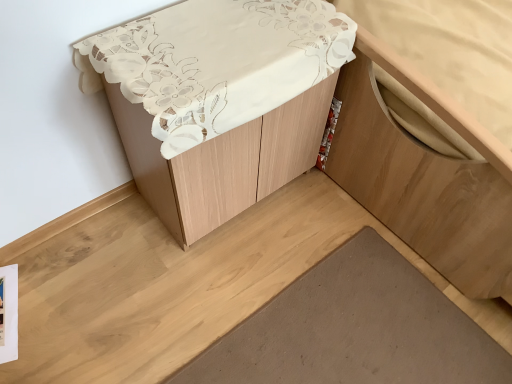
What do you see at coordinates (218, 100) in the screenshot?
I see `matte white cabinet at center` at bounding box center [218, 100].

Image resolution: width=512 pixels, height=384 pixels. Find the location of `matte white cabinet at center`. matte white cabinet at center is located at coordinates pos(218,100).

Locate an element on the screen. Image resolution: width=512 pixels, height=384 pixels. wooden cabinet at lower right is located at coordinates (424, 183).

Is wooden cabinet at lower right bigger or smaller than brown matte wood plank at lower center?

Clearly, wooden cabinet at lower right is larger in size than brown matte wood plank at lower center.

Are wooden cabinet at lower right and brown matte wood plank at lower center far apart?

No, wooden cabinet at lower right is not far from brown matte wood plank at lower center.

From a real-world perspective, is wooden cabinet at lower right physically below brown matte wood plank at lower center?

No, from a real-world perspective, wooden cabinet at lower right is not beneath brown matte wood plank at lower center.

Considering the relative positions of wooden cabinet at lower right and matte white cabinet at center in the image provided, is wooden cabinet at lower right to the right of matte white cabinet at center from the viewer's perspective?

Yes.

Which point is more distant from viewer, (372, 90) or (153, 131)?

The point (372, 90) is farther.

From the image's perspective, which one is positioned lower, wooden cabinet at lower right or matte white cabinet at center?

matte white cabinet at center appears lower in the image.

Is matte white cabinet at center to the left of brown matte wood plank at lower center from the viewer's perspective?

Correct, you'll find matte white cabinet at center to the left of brown matte wood plank at lower center.

From the image's perspective, would you say matte white cabinet at center is positioned over brown matte wood plank at lower center?

A: Yes, from the image's perspective, matte white cabinet at center is over brown matte wood plank at lower center.

Can you confirm if matte white cabinet at center is bigger than brown matte wood plank at lower center?

Indeed, matte white cabinet at center has a larger size compared to brown matte wood plank at lower center.

Is matte white cabinet at center wider or thinner than brown matte wood plank at lower center?

matte white cabinet at center is thinner than brown matte wood plank at lower center.

Which of these two, brown matte wood plank at lower center or matte white cabinet at center, is smaller?

brown matte wood plank at lower center is smaller.

Would you say brown matte wood plank at lower center is to the left or to the right of matte white cabinet at center in the picture?

brown matte wood plank at lower center is positioned on matte white cabinet at center's right side.

Who is taller, brown matte wood plank at lower center or matte white cabinet at center?

matte white cabinet at center.

Which of these two, brown matte wood plank at lower center or matte white cabinet at center, is thinner?

matte white cabinet at center is thinner.

From the image's perspective, which object appears higher, matte white cabinet at center or wooden cabinet at lower right?

wooden cabinet at lower right, from the image's perspective.

Which is closer, (173,204) or (460,215)?

The point (460,215) is closer.

Looking at this image, does matte white cabinet at center have a lesser width compared to wooden cabinet at lower right?

Yes.

At what (x,y) coordinates should I click in order to perform the action: click on cabinetry above the brown matte wood plank at lower center (from a real-world perspective). Please return your answer as a coordinate pair (x, y). This screenshot has height=384, width=512. Looking at the image, I should click on (424, 183).

Can you tell me how much brown matte wood plank at lower center and wooden cabinet at lower right differ in facing direction?

There is a 0.141-degree angle between the facing directions of brown matte wood plank at lower center and wooden cabinet at lower right.

Does brown matte wood plank at lower center turn towards wooden cabinet at lower right?

No, brown matte wood plank at lower center is not oriented towards wooden cabinet at lower right.

Considering the sizes of brown matte wood plank at lower center and wooden cabinet at lower right in the image, is brown matte wood plank at lower center bigger or smaller than wooden cabinet at lower right?

Considering their sizes, brown matte wood plank at lower center takes up less space than wooden cabinet at lower right.

Where is `cabinetry lying on the right of brown matte wood plank at lower center`? The image size is (512, 384). cabinetry lying on the right of brown matte wood plank at lower center is located at coordinates (424, 183).

In the image, there is a wooden cabinet at lower right. Where is `furniture below it (from the image's perspective)`? furniture below it (from the image's perspective) is located at coordinates (218, 100).

When comparing their distances from matte white cabinet at center, does brown matte wood plank at lower center or wooden cabinet at lower right seem further?

Based on the image, brown matte wood plank at lower center appears to be further to matte white cabinet at center.

Considering their positions, is matte white cabinet at center positioned further to brown matte wood plank at lower center than wooden cabinet at lower right?

Based on the image, matte white cabinet at center appears to be further to brown matte wood plank at lower center.

Which object lies further to the anchor point wooden cabinet at lower right, matte white cabinet at center or brown matte wood plank at lower center?

matte white cabinet at center is positioned further to the anchor wooden cabinet at lower right.

Which object lies nearer to the anchor point brown matte wood plank at lower center, wooden cabinet at lower right or matte white cabinet at center?

The object closer to brown matte wood plank at lower center is wooden cabinet at lower right.

From the image, which object appears to be nearer to wooden cabinet at lower right, brown matte wood plank at lower center or matte white cabinet at center?

Among the two, brown matte wood plank at lower center is located nearer to wooden cabinet at lower right.

Estimate the real-world distances between objects in this image. Which object is closer to matte white cabinet at center, wooden cabinet at lower right or brown matte wood plank at lower center?

Among the two, wooden cabinet at lower right is located nearer to matte white cabinet at center.

Image resolution: width=512 pixels, height=384 pixels. I want to click on plank between matte white cabinet at center and wooden cabinet at lower right from left to right, so click(x=354, y=329).